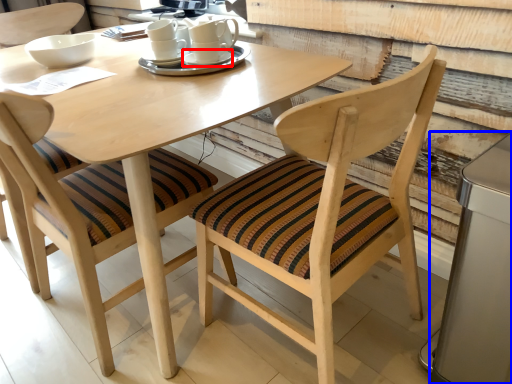
Question: Which of the following is the closest to the observer, saucer (highlighted by a red box) or appliance (highlighted by a blue box)?

Choices:
 (A) saucer
 (B) appliance

Answer: (B)